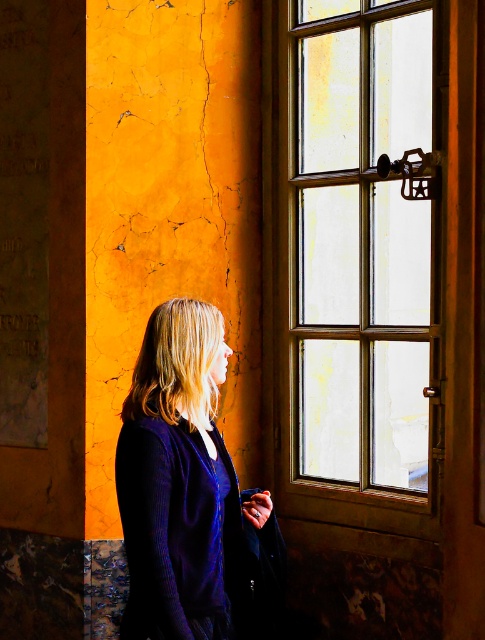
Does wooden window at right have a greater width compared to velvet purple sweater at left?

Yes.

In the scene shown: Does wooden window at right have a greater height compared to velvet purple sweater at left?

Yes, wooden window at right is taller than velvet purple sweater at left.

Locate an element on the screen. The height and width of the screenshot is (640, 485). wooden window at right is located at coordinates (355, 259).